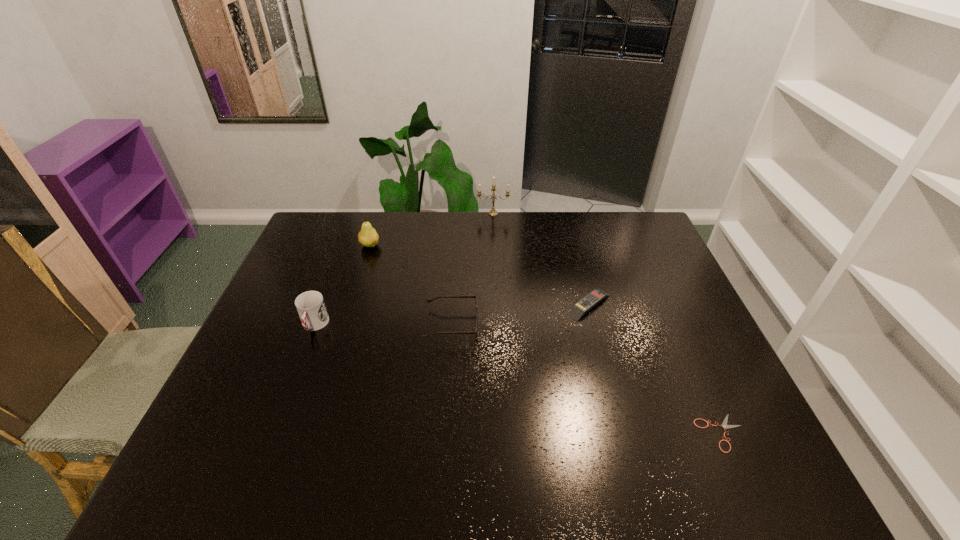
The width and height of the screenshot is (960, 540). Find the location of `shears`. shears is located at coordinates (724, 424).

At what (x,y) coordinates should I click in order to perform the action: click on free space located on the left of the tallest object. Please return your answer as a coordinate pair (x, y). Looking at the image, I should click on (380, 213).

Where is `vacant space located on the left of the pear`? vacant space located on the left of the pear is located at coordinates pyautogui.click(x=300, y=245).

What are the coordinates of `vacant space located on the handle side of the leftmost object` in the screenshot? It's located at (269, 446).

I want to click on free space located on the front lenses of the sunglasses, so click(548, 325).

Where is `blank area located 0.110m on the front of the second object from right to left`? The height and width of the screenshot is (540, 960). blank area located 0.110m on the front of the second object from right to left is located at coordinates click(x=601, y=352).

Where is `vacant region located on the back of the shears`? The height and width of the screenshot is (540, 960). vacant region located on the back of the shears is located at coordinates (662, 302).

Locate an element on the screen. candle at the far edge is located at coordinates (493, 212).

The image size is (960, 540). What are the coordinates of `pear that is at the far edge` in the screenshot? It's located at (368, 237).

The image size is (960, 540). I want to click on object situated at the near edge, so click(724, 424).